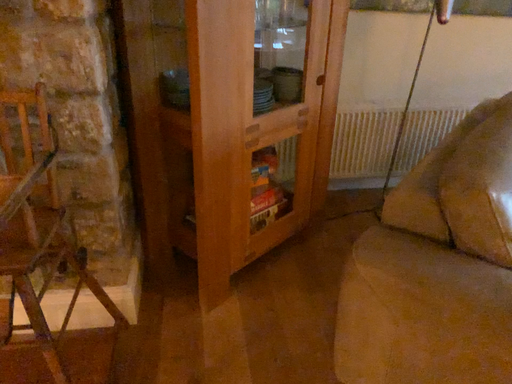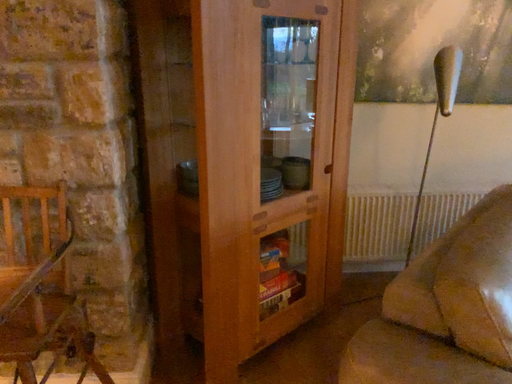
Question: How did the camera likely rotate when shooting the video?

Choices:
 (A) rotated downward
 (B) rotated upward

Answer: (B)